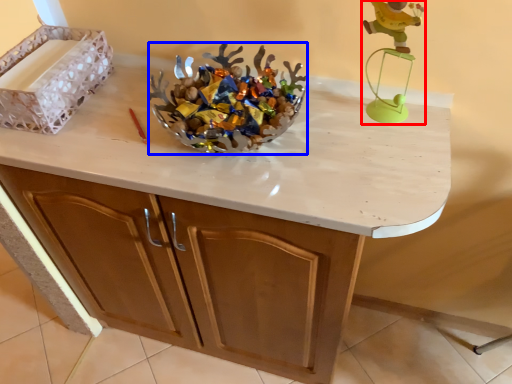
Question: Which object is closer to the camera taking this photo, toy (highlighted by a red box) or stuff (highlighted by a blue box)?

Choices:
 (A) toy
 (B) stuff

Answer: (A)